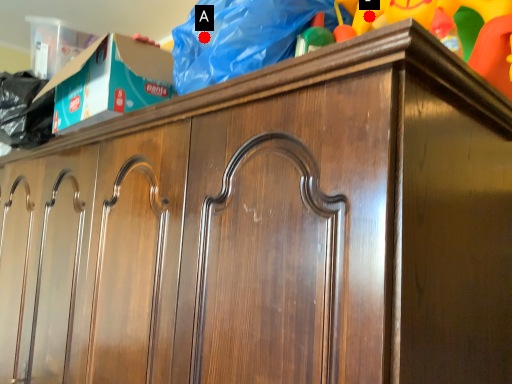
Question: Two points are circled on the image, labeled by A and B beside each circle. Which point is farther to the camera?

Choices:
 (A) A is further
 (B) B is further

Answer: (B)